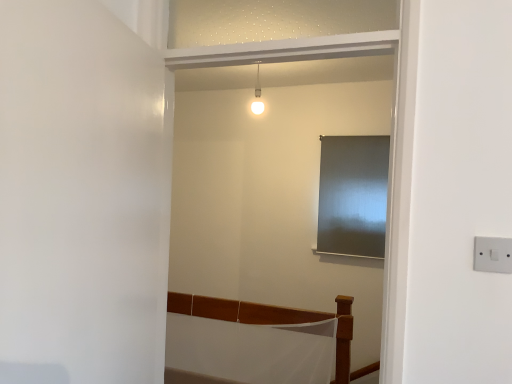
Locate an element on the screen. This screenshot has height=384, width=512. free space above satin silver curtain at center (from a real-world perspective) is located at coordinates (358, 129).